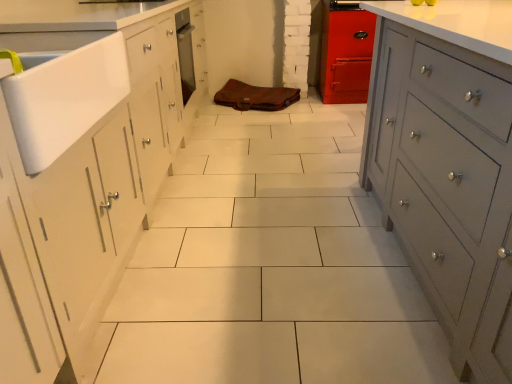
In order to face matte gray cabinet at right, should I rotate leftwards or rightwards?

To face it directly, rotate right by 33.178 degrees.

Locate an element on the screen. Image resolution: width=512 pixels, height=384 pixels. matte gray cabinet at right is located at coordinates (446, 180).

The image size is (512, 384). What do you see at coordinates (446, 180) in the screenshot?
I see `matte gray cabinet at right` at bounding box center [446, 180].

The height and width of the screenshot is (384, 512). In order to click on matte gray cabinet at right in this screenshot , I will do `click(446, 180)`.